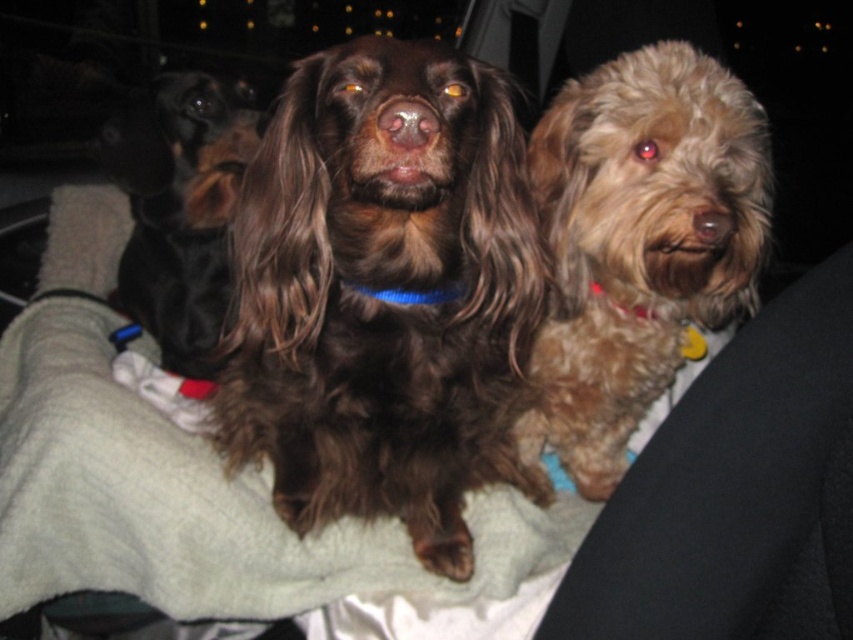
Which of these two, brown furry dog at center or black shiny dog at left, stands shorter?

black shiny dog at left

Can you confirm if brown furry dog at center is smaller than black shiny dog at left?

No, brown furry dog at center is not smaller than black shiny dog at left.

You are a GUI agent. You are given a task and a screenshot of the screen. Output one action in this format:
    pyautogui.click(x=<x>, y=<y>)
    Task: Click on the brown furry dog at center
    The width and height of the screenshot is (853, 640).
    Given the screenshot: What is the action you would take?
    pyautogui.click(x=381, y=288)

Is point (335, 84) closer to viewer compared to point (439, 294)?

Yes.

Between point (329, 372) and point (401, 294), which one is positioned behind?

The point (329, 372) is behind.

Locate an element on the screen. The image size is (853, 640). brown furry dog at center is located at coordinates (381, 288).

Find the location of a particular element. This screenshot has width=853, height=640. brown furry dog at center is located at coordinates (381, 288).

I want to click on fuzzy brown dog at center, so click(639, 243).

Who is shorter, fuzzy brown dog at center or blue fabric neckband at center?

With less height is blue fabric neckband at center.

Who is more distant from viewer, (633, 54) or (445, 289)?

Positioned behind is point (633, 54).

Where is `fuzzy brown dog at center`? fuzzy brown dog at center is located at coordinates (639, 243).